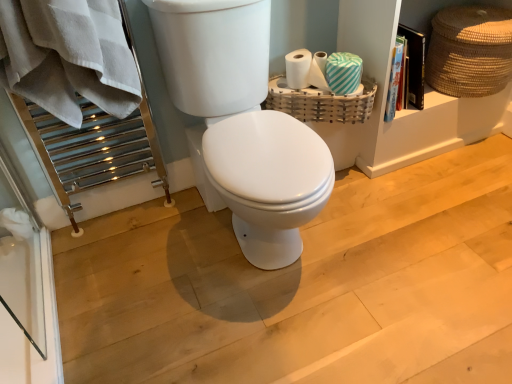
You are a GUI agent. You are given a task and a screenshot of the screen. Output one action in this format:
    pyautogui.click(x=<x>, y=<y>)
    Task: Click on the blank space above woven bamboo basket at upper right, which is the 1th basket from left to right (from a real-world perspective)
    The width and height of the screenshot is (512, 384).
    Given the screenshot: What is the action you would take?
    pyautogui.click(x=313, y=80)